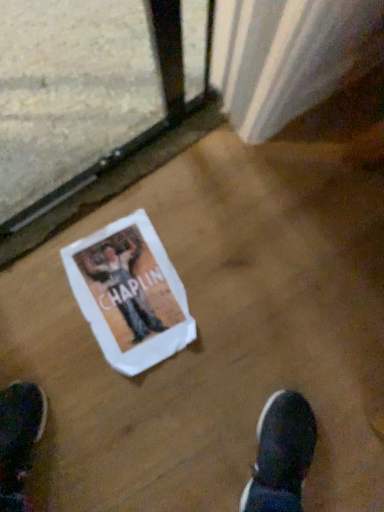
Where is `vacant space in front of white paper flyer at center`? This screenshot has width=384, height=512. vacant space in front of white paper flyer at center is located at coordinates (136, 410).